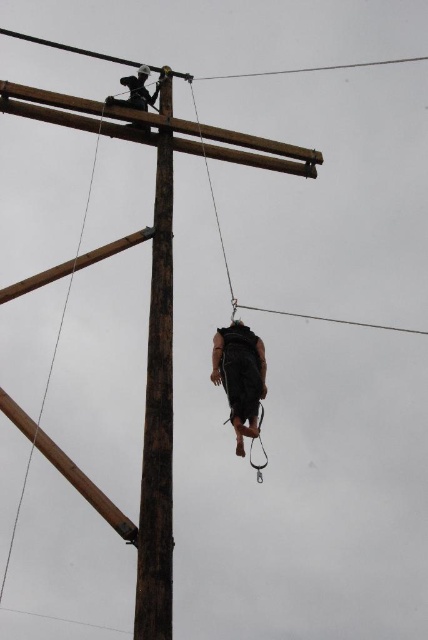
Question: Does clear wire at upper center appear over black wire at center?

Choices:
 (A) no
 (B) yes

Answer: (B)

Question: Which point is closer to the camera?

Choices:
 (A) smooth wire at upper center
 (B) dark brown leather helmet at upper center
 (C) smooth wooden telegraph pole at center
 (D) clear wire at upper center

Answer: (C)

Question: Is smooth wooden telegraph pole at center thinner than clear wire at upper center?

Choices:
 (A) yes
 (B) no

Answer: (A)

Question: Does smooth wire at upper center come behind clear wire at upper center?

Choices:
 (A) no
 (B) yes

Answer: (A)

Question: Which is farther from the smooth wire at upper center?

Choices:
 (A) clear wire at upper center
 (B) dark brown leather helmet at upper center
 (C) smooth wooden telegraph pole at center
 (D) black matte vest at center

Answer: (D)

Question: Which of these objects is positioned farthest from the smooth wooden telegraph pole at center?

Choices:
 (A) dark brown leather helmet at upper center
 (B) black matte vest at center
 (C) smooth wire at upper center
 (D) clear wire at upper center

Answer: (D)